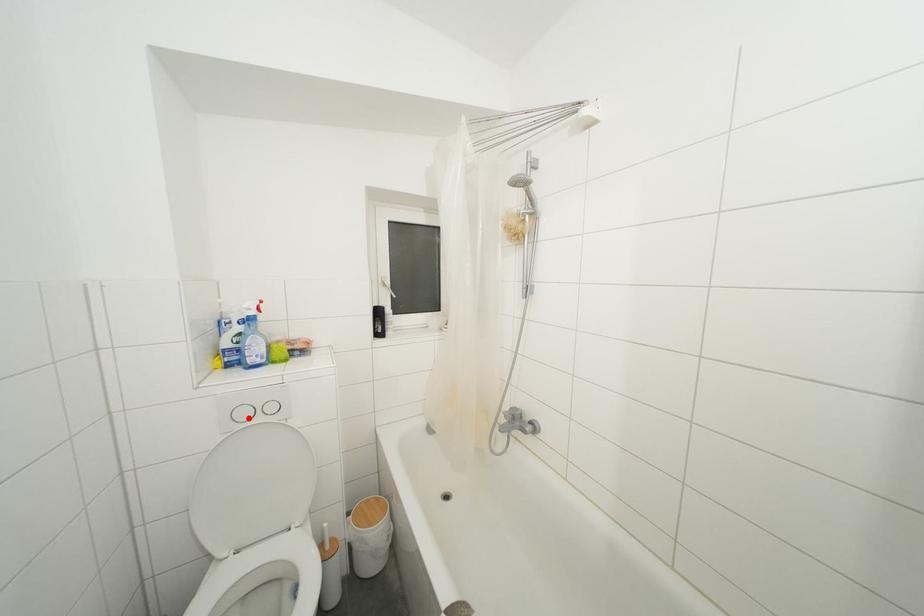
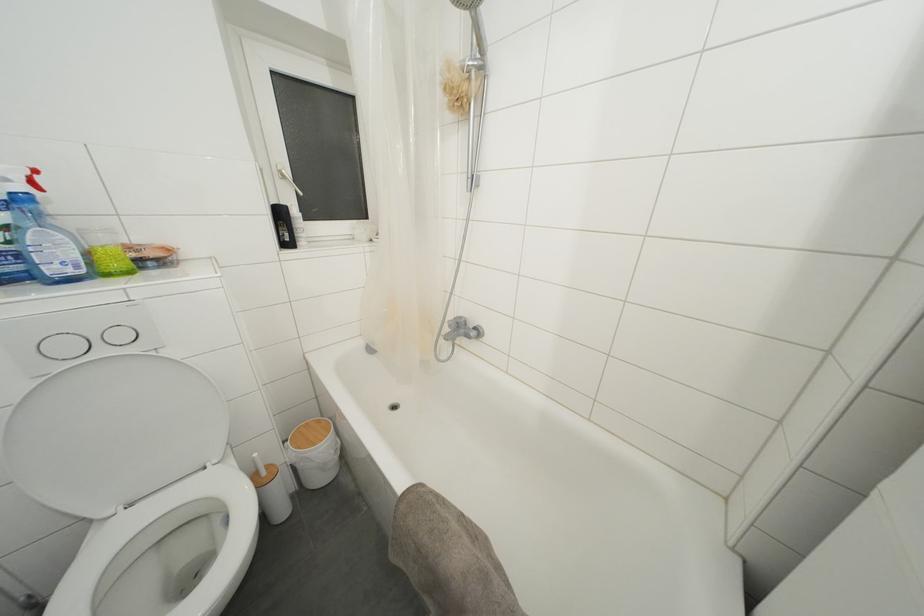
Question: A red point is marked in image1. In image2, is the corresponding 3D point closer to the camera or farther? Reply with the corresponding letter.

Choices:
 (A) The corresponding 3D point is closer.
 (B) The corresponding 3D point is farther.

Answer: (B)